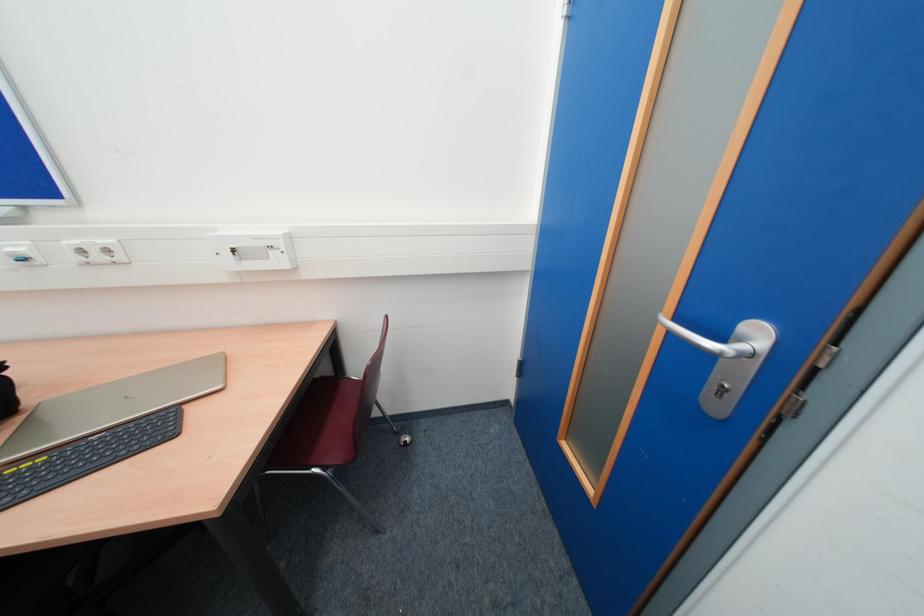
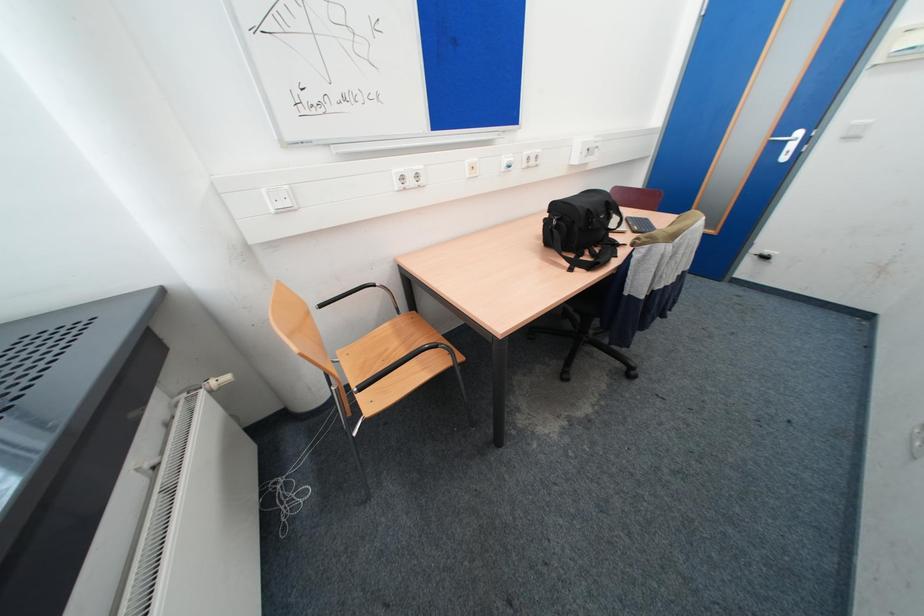
Question: The images are taken continuously from a first-person perspective. In which direction are you moving?

Choices:
 (A) Left
 (B) Right
 (C) Forward
 (D) Backward

Answer: (A)